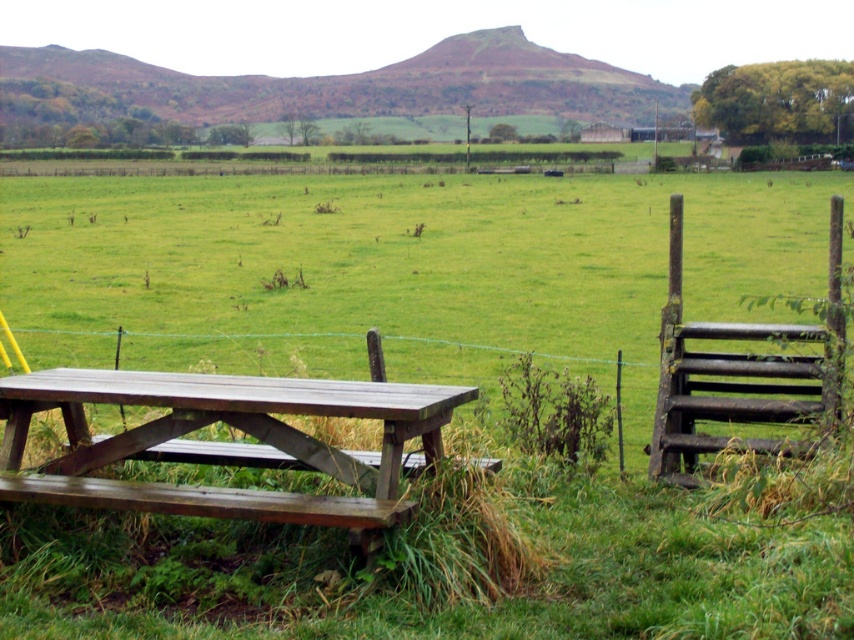
Based on the photo, is wooden picnic table at lower left closer to camera compared to rustic wooden gate at right?

That is True.

Can you confirm if wooden picnic table at lower left is positioned to the left of rustic wooden gate at right?

Indeed, wooden picnic table at lower left is positioned on the left side of rustic wooden gate at right.

The width and height of the screenshot is (854, 640). What are the coordinates of `wooden picnic table at lower left` in the screenshot? It's located at (227, 442).

What are the coordinates of `wooden picnic table at lower left` in the screenshot? It's located at (227, 442).

Between green wood field at center and wooden picnic table at lower left, which one is positioned lower?

wooden picnic table at lower left

Does point (644, 317) come behind point (262, 392)?

That is True.

Find the location of `green wood field at center`. green wood field at center is located at coordinates (401, 272).

Is green wood field at center to the left of rustic wooden gate at right from the viewer's perspective?

Indeed, green wood field at center is positioned on the left side of rustic wooden gate at right.

Between green wood field at center and rustic wooden gate at right, which one appears on the right side from the viewer's perspective?

rustic wooden gate at right

Between point (548, 236) and point (673, 340), which one is positioned in front?

Point (673, 340) is in front.

Identify the location of green wood field at center. This screenshot has height=640, width=854. (401, 272).